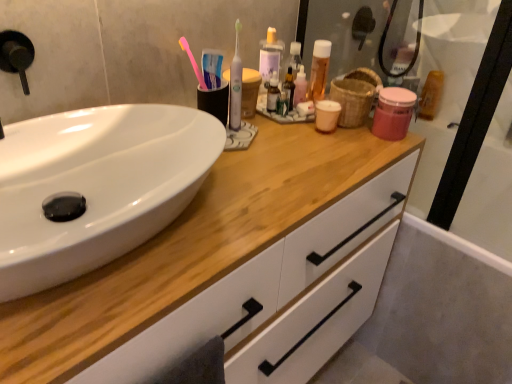
Locate an element on the screen. The image size is (512, 384). empty space that is ontop of white matte cabinet at center (from a real-world perspective) is located at coordinates click(x=262, y=167).